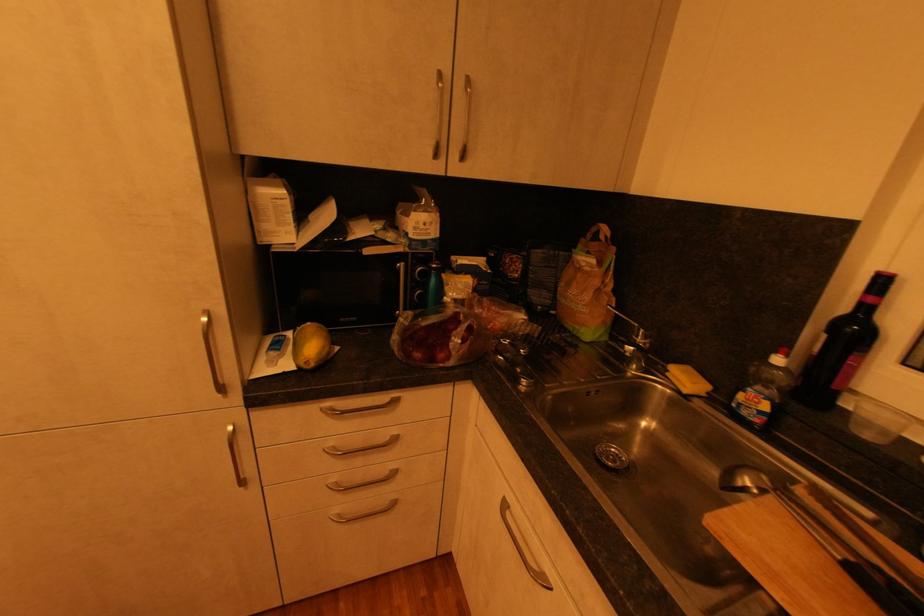
Describe the element at coordinates (635, 331) in the screenshot. This screenshot has height=616, width=924. I see `a sink faucet handle` at that location.